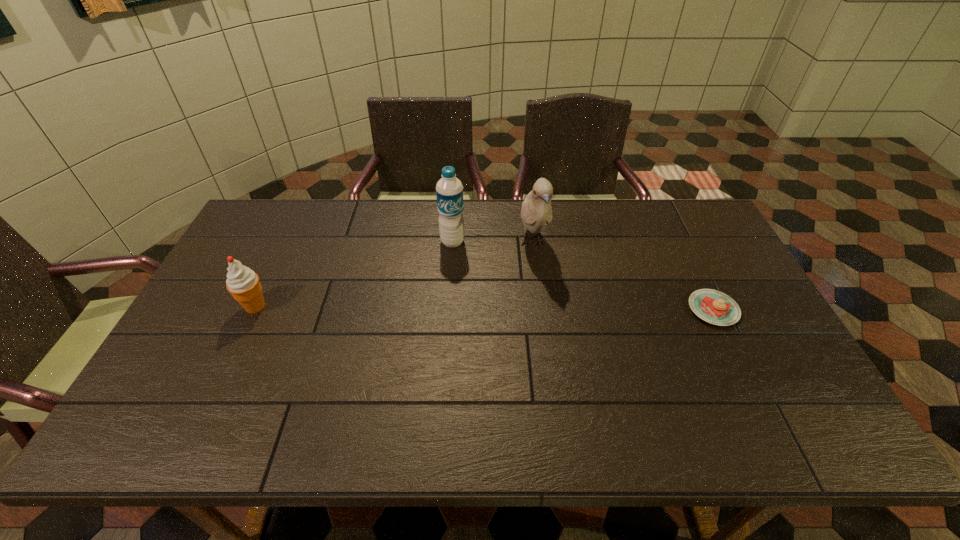
Find the location of a particular element. The height and width of the screenshot is (540, 960). free space at the left edge of the desktop is located at coordinates pyautogui.click(x=244, y=310).

The width and height of the screenshot is (960, 540). What are the coordinates of `vacant space at the right edge of the desktop` in the screenshot? It's located at (719, 332).

Locate an element on the screen. vacant region at the far left corner of the desktop is located at coordinates (273, 240).

Where is `vacant space at the far right corner of the desktop`? The width and height of the screenshot is (960, 540). vacant space at the far right corner of the desktop is located at coordinates (699, 213).

I want to click on vacant region between the third object from right to left and the second object from right to left, so click(492, 242).

Identify the location of free space between the water bottle and the bird. (492, 242).

The image size is (960, 540). What are the coordinates of `vacant region between the third object from right to left and the shortest object` in the screenshot? It's located at (583, 275).

Where is `free spot between the bird and the shortest object`? The width and height of the screenshot is (960, 540). free spot between the bird and the shortest object is located at coordinates (623, 276).

Where is `empty location between the third object from left to right and the leftmost object`? The height and width of the screenshot is (540, 960). empty location between the third object from left to right and the leftmost object is located at coordinates (395, 275).

The height and width of the screenshot is (540, 960). I want to click on vacant area between the icecream and the rightmost object, so click(x=484, y=308).